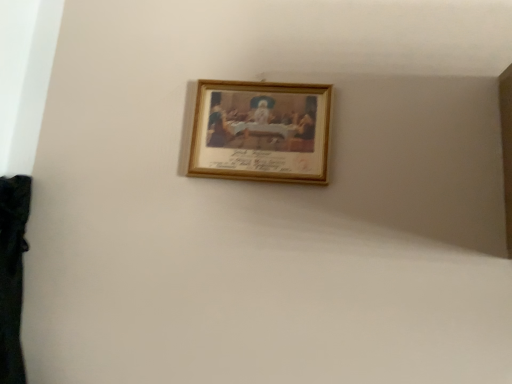
Identify the location of gold wooden picture frame at upper center. (261, 131).

Describe the element at coordinates (261, 131) in the screenshot. I see `gold wooden picture frame at upper center` at that location.

At what (x,y) coordinates should I click in order to perform the action: click on gold wooden picture frame at upper center. Please return your answer as a coordinate pair (x, y). The width and height of the screenshot is (512, 384). Looking at the image, I should click on (261, 131).